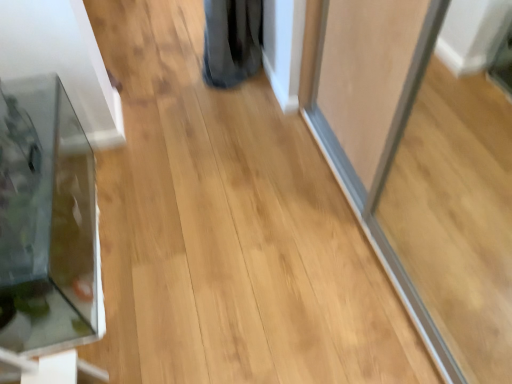
This screenshot has width=512, height=384. What do you see at coordinates (47, 234) in the screenshot?
I see `clear glass aquarium at left` at bounding box center [47, 234].

The width and height of the screenshot is (512, 384). In order to click on clear glass aquarium at left in this screenshot , I will do `click(47, 234)`.

Find the location of a particular element. This screenshot has width=512, height=384. clear glass aquarium at left is located at coordinates (47, 234).